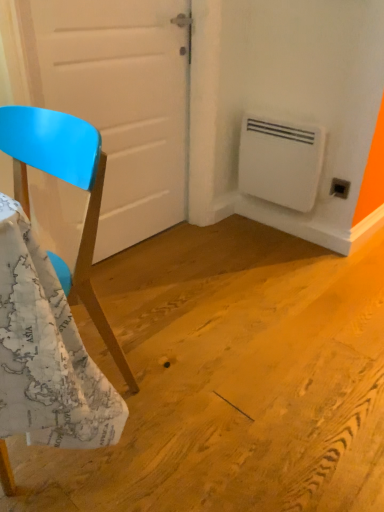
Question: Considering the relative sizes of white plastic air conditioning unit at lower right and matte blue chair at left in the image provided, is white plastic air conditioning unit at lower right smaller than matte blue chair at left?

Choices:
 (A) no
 (B) yes

Answer: (B)

Question: From a real-world perspective, is white plastic air conditioning unit at lower right positioned over matte blue chair at left based on gravity?

Choices:
 (A) no
 (B) yes

Answer: (A)

Question: Is matte blue chair at left completely or partially inside white plastic air conditioning unit at lower right?

Choices:
 (A) yes
 (B) no

Answer: (B)

Question: From a real-world perspective, is white plastic air conditioning unit at lower right below matte blue chair at left?

Choices:
 (A) yes
 (B) no

Answer: (A)

Question: Would you say white plastic air conditioning unit at lower right is a long distance from matte blue chair at left?

Choices:
 (A) yes
 (B) no

Answer: (A)

Question: Is the position of white plastic air conditioning unit at lower right more distant than that of matte blue chair at left?

Choices:
 (A) yes
 (B) no

Answer: (A)

Question: Is white plastic air conditioning unit at lower right at the right side of black plastic electric outlet at lower right?

Choices:
 (A) no
 (B) yes

Answer: (A)

Question: Does white plastic air conditioning unit at lower right have a greater width compared to black plastic electric outlet at lower right?

Choices:
 (A) yes
 (B) no

Answer: (A)

Question: Is white plastic air conditioning unit at lower right not close to black plastic electric outlet at lower right?

Choices:
 (A) yes
 (B) no

Answer: (B)

Question: From a real-world perspective, is white plastic air conditioning unit at lower right located beneath black plastic electric outlet at lower right?

Choices:
 (A) no
 (B) yes

Answer: (A)

Question: Considering the relative sizes of white plastic air conditioning unit at lower right and black plastic electric outlet at lower right in the image provided, is white plastic air conditioning unit at lower right shorter than black plastic electric outlet at lower right?

Choices:
 (A) no
 (B) yes

Answer: (A)

Question: Is white plastic air conditioning unit at lower right in front of black plastic electric outlet at lower right?

Choices:
 (A) no
 (B) yes

Answer: (B)

Question: From a real-world perspective, is black plastic electric outlet at lower right on top of white plastic air conditioning unit at lower right?

Choices:
 (A) yes
 (B) no

Answer: (B)